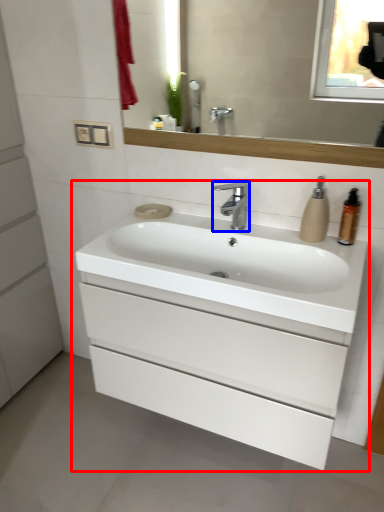
Question: Which object is further to the camera taking this photo, bathroom cabinet (highlighted by a red box) or tap (highlighted by a blue box)?

Choices:
 (A) bathroom cabinet
 (B) tap

Answer: (B)